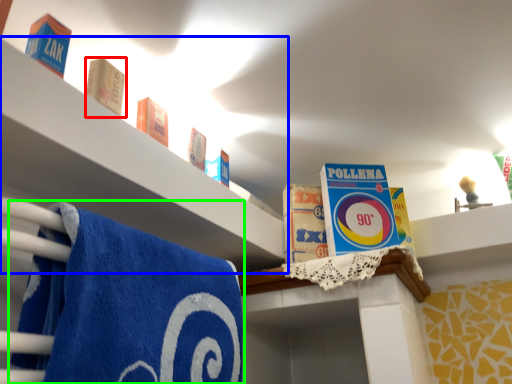
Question: Which is nearer to the product (highlighted by a red box)? shelf (highlighted by a blue box) or towel (highlighted by a green box).

Choices:
 (A) shelf
 (B) towel

Answer: (A)